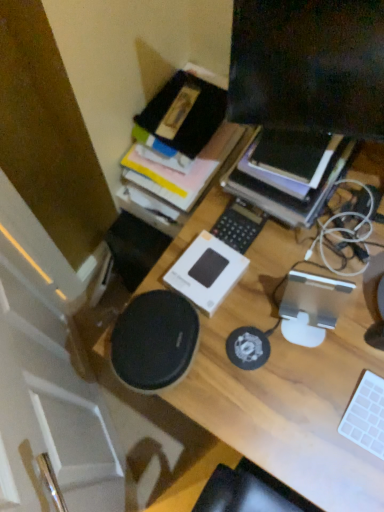
Locate an element on the screen. This screenshot has width=384, height=512. empty space that is ontop of wooden desk at center (from a real-world perspective) is located at coordinates (342, 323).